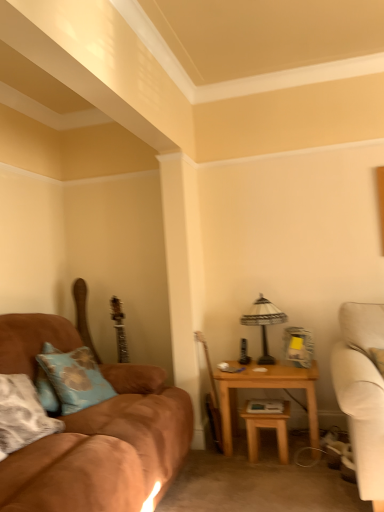
Question: In terms of width, does blue fabric pillow at left look wider or thinner when compared to suede brown couch at left?

Choices:
 (A) thin
 (B) wide

Answer: (A)

Question: Is point (97, 384) positioned closer to the camera than point (44, 477)?

Choices:
 (A) farther
 (B) closer

Answer: (A)

Question: Estimate the real-world distances between objects in this image. Which object is closer to the white textured lampshade at right?

Choices:
 (A) light brown wooden table at right, which ranks as the 1th table in right-to-left order
 (B) suede brown couch at left
 (C) wooden table at right, which is the second table in right-to-left order
 (D) blue fabric pillow at left

Answer: (A)

Question: Estimate the real-world distances between objects in this image. Which object is farther from the white textured lampshade at right?

Choices:
 (A) light brown wooden table at right, the second table positioned from the left
 (B) wooden table at right, which is the second table in right-to-left order
 (C) suede brown couch at left
 (D) blue fabric pillow at left

Answer: (D)